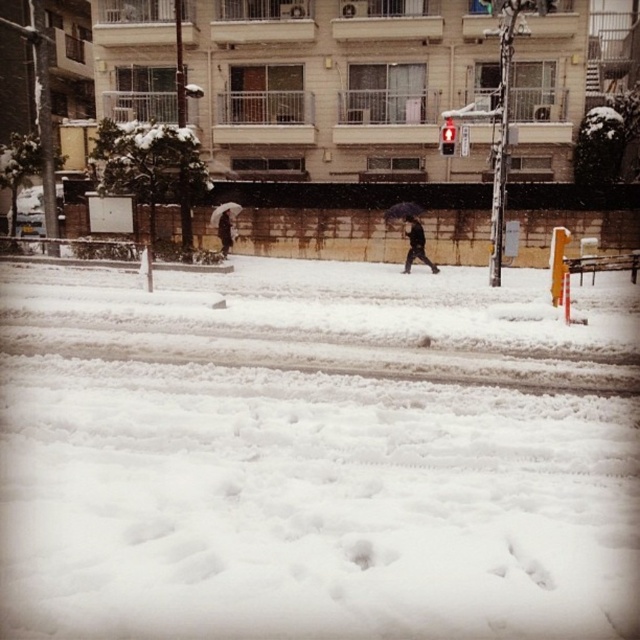
You are a photographer trying to capture a clear shot of the dark brown leather jacket at center without the black matte umbrella at center blocking it. Based on the scene, can you adjust your position to achieve this?

The dark brown leather jacket at center is in front of the black matte umbrella at center, so moving your camera position slightly to the side might allow you to capture the jacket without the umbrella blocking it.